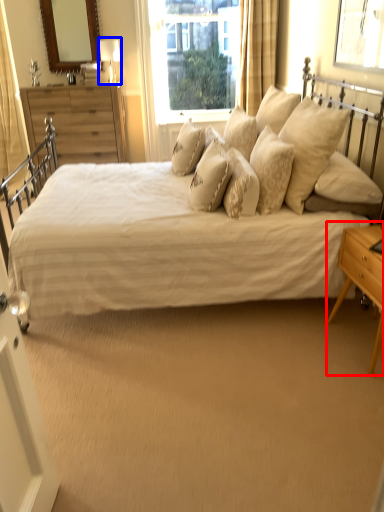
Question: Which object appears farthest to the camera in this image, nightstand (highlighted by a red box) or table lamp (highlighted by a blue box)?

Choices:
 (A) nightstand
 (B) table lamp

Answer: (B)